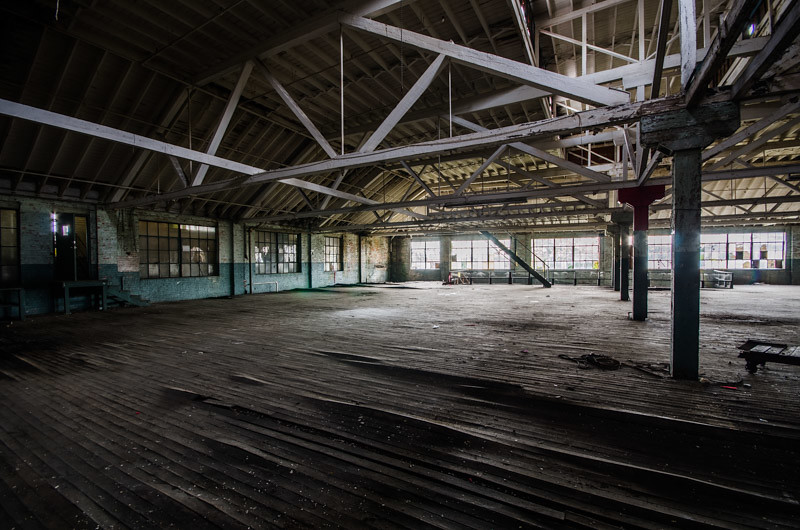
Locate an element on the screen. This screenshot has height=530, width=800. doorway is located at coordinates (80, 253).